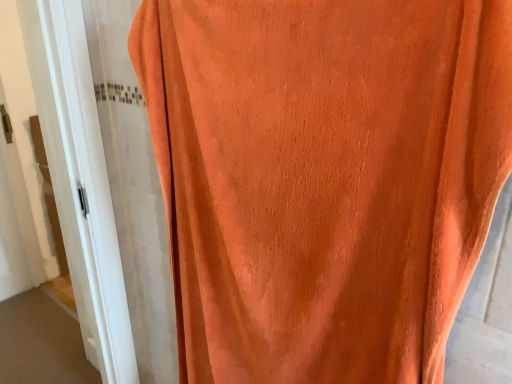
What do you see at coordinates (80, 180) in the screenshot? This screenshot has width=512, height=384. I see `orange fabric at left` at bounding box center [80, 180].

Locate an element on the screen. This screenshot has width=512, height=384. orange fabric at left is located at coordinates (80, 180).

Locate an element on the screen. This screenshot has height=384, width=512. orange fabric at left is located at coordinates click(80, 180).